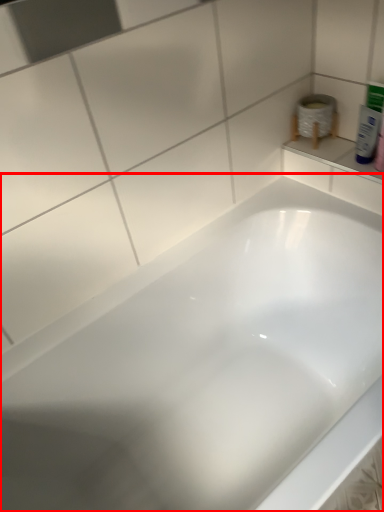
Question: From the image's perspective, what is the correct spatial relationship of bathtub (annotated by the red box) in relation to mouthwash?

Choices:
 (A) above
 (B) below

Answer: (B)